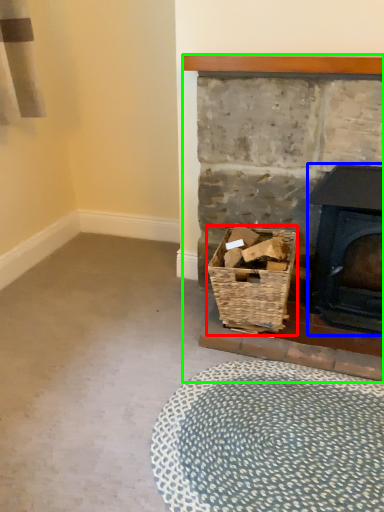
Question: Based on their relative distances, which object is nearer to basket (highlighted by a red box)? Choose from wood burning stove (highlighted by a blue box) and fireplace (highlighted by a green box).

Choices:
 (A) wood burning stove
 (B) fireplace

Answer: (B)